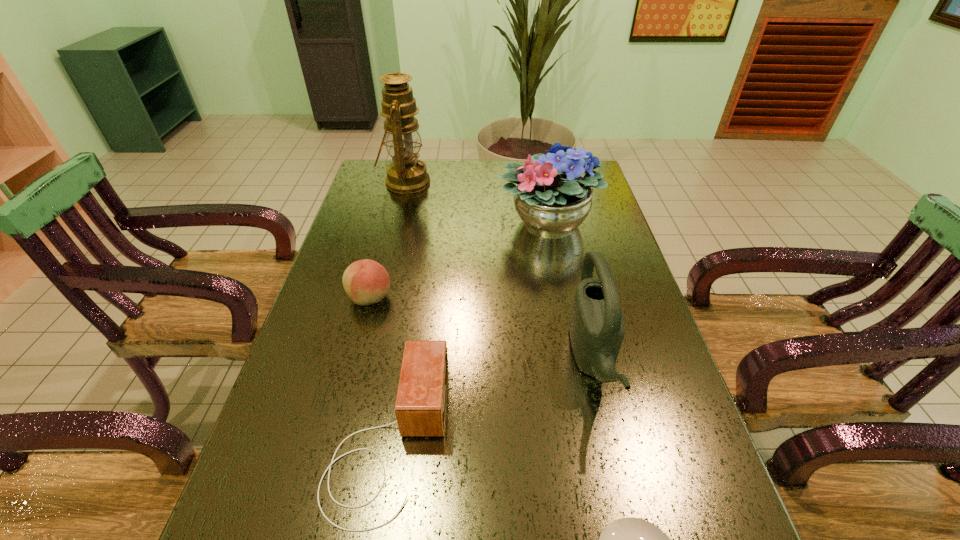
Locate an element on the screen. The height and width of the screenshot is (540, 960). object that stands as the second closest to the radio receiver is located at coordinates point(629,539).

Choose which object is the fourth nearest neighbor to the shortest object. Please provide its 2D coordinates. Your answer should be formatted as a tuple, i.e. [(x, y)], where the tuple contains the x and y coordinates of a point satisfying the conditions above.

[(551, 197)]